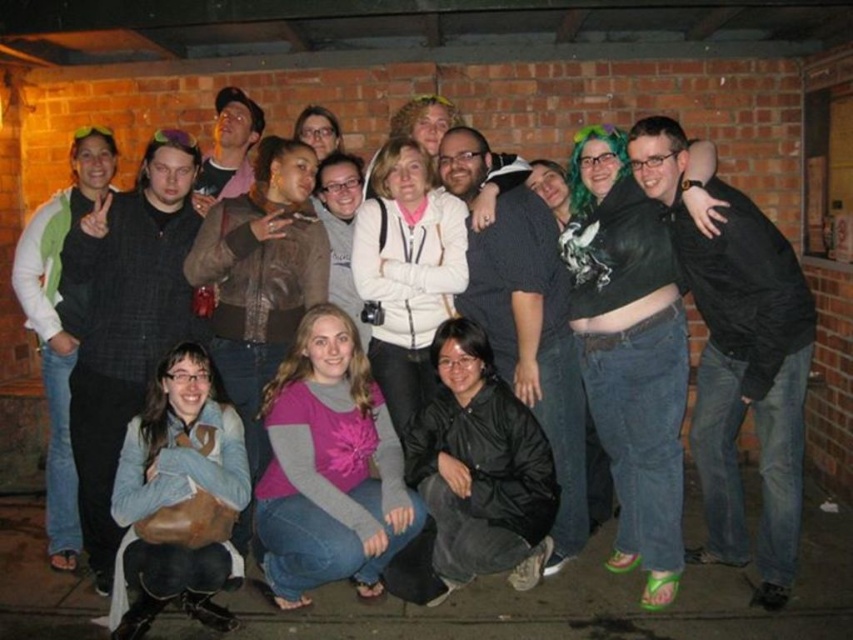
Question: Which object appears closest to the camera in this image?

Choices:
 (A) black leather jacket at center
 (B) matte black jacket at left
 (C) white fleece jacket at lower left

Answer: (A)

Question: Is black leather jacket at center positioned in front of white fleece jacket at center?

Choices:
 (A) no
 (B) yes

Answer: (B)

Question: Which point appears closest to the camera in this image?

Choices:
 (A) (294, 387)
 (B) (234, 353)

Answer: (A)

Question: Is black leather jacket at center wider than pink fabric shirt at center?

Choices:
 (A) yes
 (B) no

Answer: (A)

Question: Among these objects, which one is nearest to the camera?

Choices:
 (A) matte black jacket at center
 (B) brown leather jacket at center
 (C) matte white hoodie at center
 (D) leather brown purse at lower left

Answer: (D)

Question: Is black matte jacket at center in front of matte white jacket at center?

Choices:
 (A) no
 (B) yes

Answer: (B)